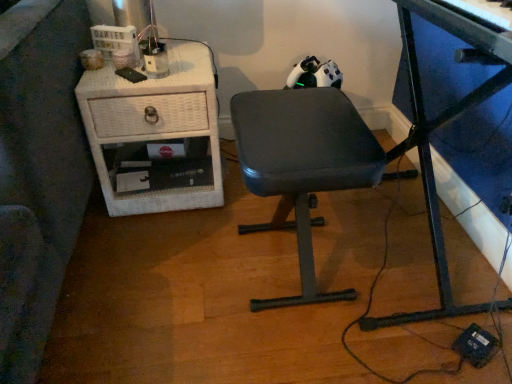
I want to click on vacant space underneath dark gray fabric chair at center (from a real-world perspective), so click(279, 269).